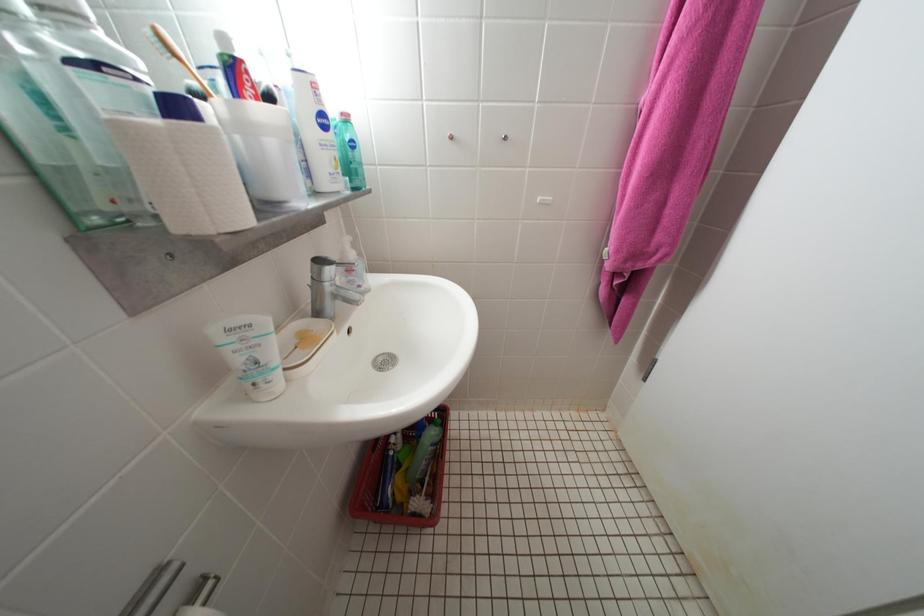
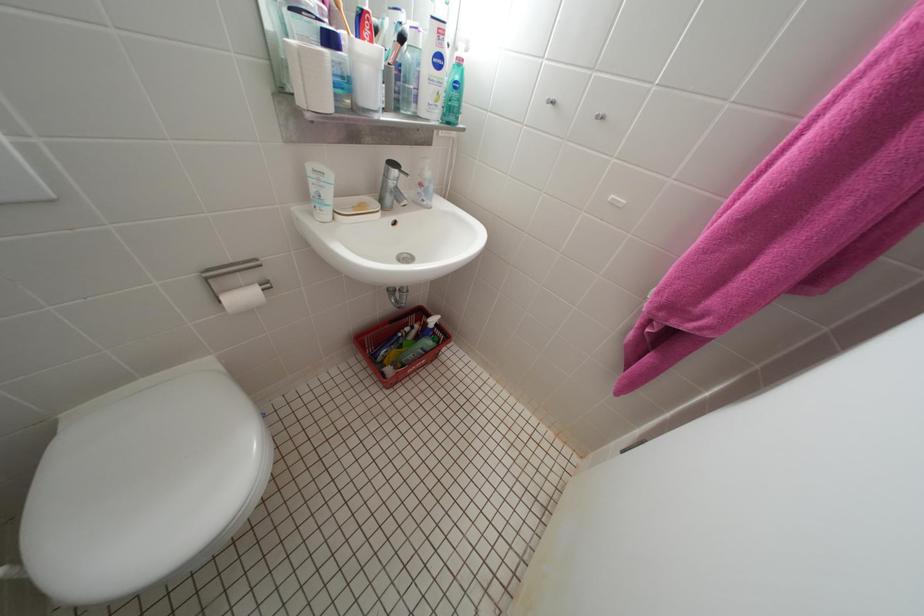
Question: How did the camera likely rotate?

Choices:
 (A) Left
 (B) Right
 (C) Up
 (D) Down

Answer: (A)